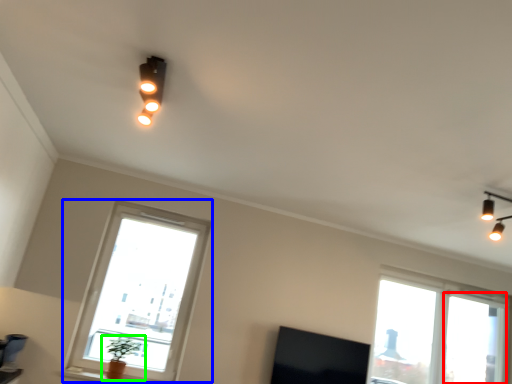
Question: Which is nearer to the window frame (highlighted by a red box)? window (highlighted by a blue box) or houseplant (highlighted by a green box).

Choices:
 (A) window
 (B) houseplant

Answer: (A)